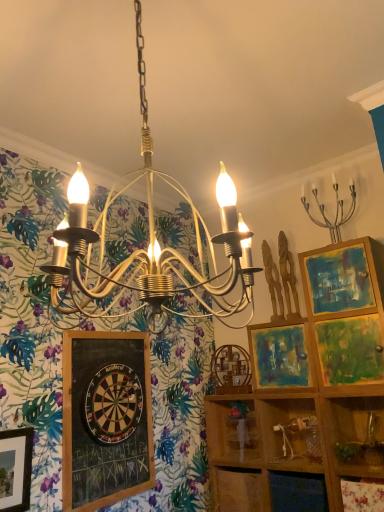
Image resolution: width=384 pixels, height=512 pixels. Identify the location of metallic chandelier at center. (150, 243).

This screenshot has height=512, width=384. In order to click on wooden at center in this screenshot , I will do `click(288, 443)`.

Measure the distance between point (243, 457) and camera.

Point (243, 457) is 8.64 feet from camera.

The width and height of the screenshot is (384, 512). I want to click on clear plastic bottle at lower right, the second cabinet viewed from the left, so click(290, 432).

This screenshot has height=512, width=384. Identify the location of black chalkboard at lower left. (106, 419).

You are a GUI agent. You are given a task and a screenshot of the screen. Output one action in this format:
    pyautogui.click(x=<x>, y=<y>)
    Task: Click on the metallic chandelier at center
    
    Given the screenshot: What is the action you would take?
    pyautogui.click(x=150, y=243)

Which object is further away from the camera taking this photo, matte wooden picture frame at center right or metallic chandelier at center?

matte wooden picture frame at center right is further away from the camera.

From the image's perspective, is matte wooden picture frame at center right under metallic chandelier at center?

Yes, from the image's perspective, matte wooden picture frame at center right is beneath metallic chandelier at center.

Does matte wooden picture frame at center right touch metallic chandelier at center?

No, matte wooden picture frame at center right is not in contact with metallic chandelier at center.

Is point (311, 386) farther from viewer compared to point (170, 177)?

No, (311, 386) is in front of (170, 177).

Between matte wooden picture frame at center right and silver metallic candelabra at upper right, which one has more height?

Standing taller between the two is silver metallic candelabra at upper right.

In the image, is matte wooden picture frame at center right positioned in front of or behind silver metallic candelabra at upper right?

In the image, matte wooden picture frame at center right appears behind silver metallic candelabra at upper right.

From the picture: Who is bigger, matte wooden picture frame at center right or silver metallic candelabra at upper right?

matte wooden picture frame at center right is bigger.

Locate an element on the screen. picture frame on the left of silver metallic candelabra at upper right is located at coordinates (279, 356).

Consider the image. Is wooden dartboard at center closer to the viewer compared to matte wooden picture frame at center right?

Yes, it is.

Does wooden dartboard at center turn towards matte wooden picture frame at center right?

No, wooden dartboard at center does not turn towards matte wooden picture frame at center right.

Can you confirm if wooden dartboard at center is thinner than matte wooden picture frame at center right?

Yes.

From the image's perspective, who appears lower, wooden dartboard at center or matte wooden picture frame at center right?

wooden dartboard at center is shown below in the image.

At what (x,y) coordinates should I click in order to perform the action: click on picture frame that appears on the left of wooden shelf at lower right. Please return your answer as a coordinate pair (x, y). This screenshot has height=512, width=384. Looking at the image, I should click on (279, 356).

Is wooden shelf at lower right inside matte wooden picture frame at center right?

Definitely not — wooden shelf at lower right is not inside matte wooden picture frame at center right.

Which is in front, matte wooden picture frame at center right or wooden shelf at lower right?

wooden shelf at lower right is closer to the camera.

Are wooden shelf at lower right and metallic chandelier at center beside each other?

wooden shelf at lower right and metallic chandelier at center are clearly separated.

Is wooden shelf at lower right inside or outside of metallic chandelier at center?

The correct answer is: outside.

In the scene shown: From a real-world perspective, between black chalkboard at lower left and wooden dartboard at center, who is vertically higher?

wooden dartboard at center, from a real-world perspective.

What's the angular difference between black chalkboard at lower left and wooden dartboard at center's facing directions?

0.152 degrees.

From the image's perspective, which one is positioned higher, black chalkboard at lower left or wooden dartboard at center?

wooden dartboard at center, from the image's perspective.

Relative to wooden dartboard at center, is black chalkboard at lower left in front or behind?

black chalkboard at lower left is positioned closer to the viewer than wooden dartboard at center.

Is matte wooden picture frame at center right a part of metallic chandelier at center?

That's incorrect, matte wooden picture frame at center right is not inside metallic chandelier at center.

From the picture: Is metallic chandelier at center facing towards matte wooden picture frame at center right?

No.

Is metallic chandelier at center far away from matte wooden picture frame at center right?

No, metallic chandelier at center is in close proximity to matte wooden picture frame at center right.

Does point (146, 115) come closer to viewer compared to point (277, 374)?

Yes, point (146, 115) is closer to viewer.

This screenshot has height=512, width=384. In order to click on lamp located above the matte wooden picture frame at center right (from a real-world perspective) in this screenshot , I will do `click(150, 243)`.

Where is `light fixture in front of the matte wooden picture frame at center right`? light fixture in front of the matte wooden picture frame at center right is located at coordinates (336, 210).

Estimate the real-world distances between objects in this image. Which object is further from black chalkboard at lower left, wooden cabinet at lower center, the second cabinet positioned from the right, or wooden shelf at lower right?

wooden shelf at lower right.

Looking at the image, which one is located closer to wooden dartboard at center, wooden cabinet at lower center, which is the 1th cabinet from left to right, or clear plastic bottle at lower right, the second cabinet viewed from the left?

The object closer to wooden dartboard at center is wooden cabinet at lower center, which is the 1th cabinet from left to right.

Based on their spatial positions, is clear plastic bottle at lower right, the second cabinet viewed from the left, or wooden shelf at lower right further from black chalkboard at lower left?

wooden shelf at lower right.

Looking at the image, which one is located closer to matte wooden picture frame at center right, wooden dartboard at center or black chalkboard at lower left?

The object closer to matte wooden picture frame at center right is wooden dartboard at center.

From the image, which object appears to be nearer to wooden shelf at lower right, wooden dartboard at center or matte wooden picture frame at center right?

The object closer to wooden shelf at lower right is matte wooden picture frame at center right.

Estimate the real-world distances between objects in this image. Which object is further from clear plastic bottle at lower right, the 1th cabinet positioned from the right, metallic chandelier at center or silver metallic candelabra at upper right?

silver metallic candelabra at upper right lies further to clear plastic bottle at lower right, the 1th cabinet positioned from the right, than the other object.

From the image, which object appears to be nearer to wooden shelf at lower right, matte wooden picture frame at center right or clear plastic bottle at lower right, the second cabinet viewed from the left?

The object closer to wooden shelf at lower right is clear plastic bottle at lower right, the second cabinet viewed from the left.

In the scene shown: When comparing their distances from silver metallic candelabra at upper right, does wooden at center or clear plastic bottle at lower right, the second cabinet viewed from the left, seem closer?

clear plastic bottle at lower right, the second cabinet viewed from the left, lies closer to silver metallic candelabra at upper right than the other object.

I want to click on picture frame positioned between metallic chandelier at center and wooden cabinet at lower center, the second cabinet positioned from the right, from near to far, so click(x=279, y=356).

Where is `dresser between wooden dartboard at center and clear plastic bottle at lower right, the 1th cabinet positioned from the right, in the horizontal direction`? dresser between wooden dartboard at center and clear plastic bottle at lower right, the 1th cabinet positioned from the right, in the horizontal direction is located at coordinates (288, 443).

This screenshot has width=384, height=512. I want to click on bulletin board located between metallic chandelier at center and silver metallic candelabra at upper right in the depth direction, so click(x=106, y=419).

I want to click on light fixture between metallic chandelier at center and wooden cabinet at lower center, the second cabinet positioned from the right, along the z-axis, so click(336, 210).